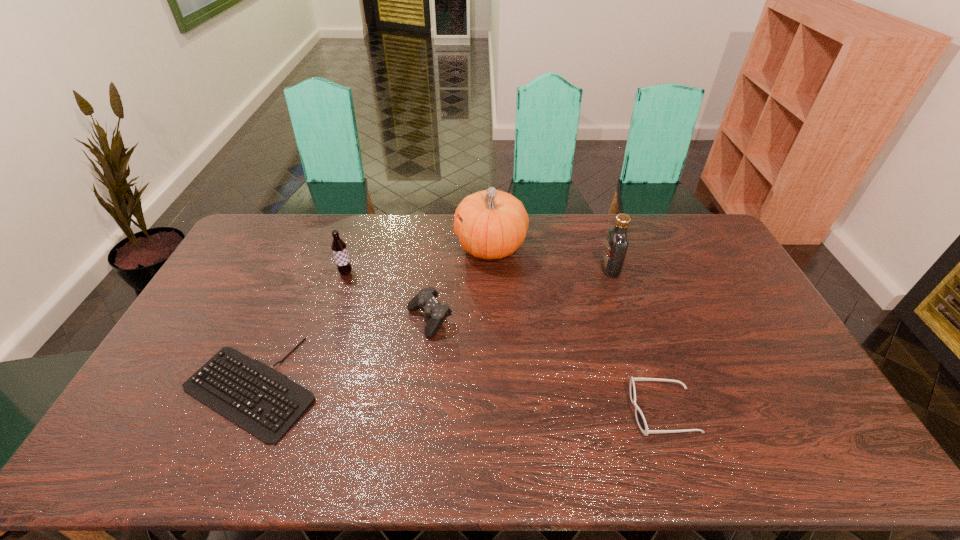
The image size is (960, 540). In order to click on free location that satisfies the following two spatial constraints: 1. on the front side of the root beer; 2. on the right side of the control in this screenshot , I will do `click(330, 320)`.